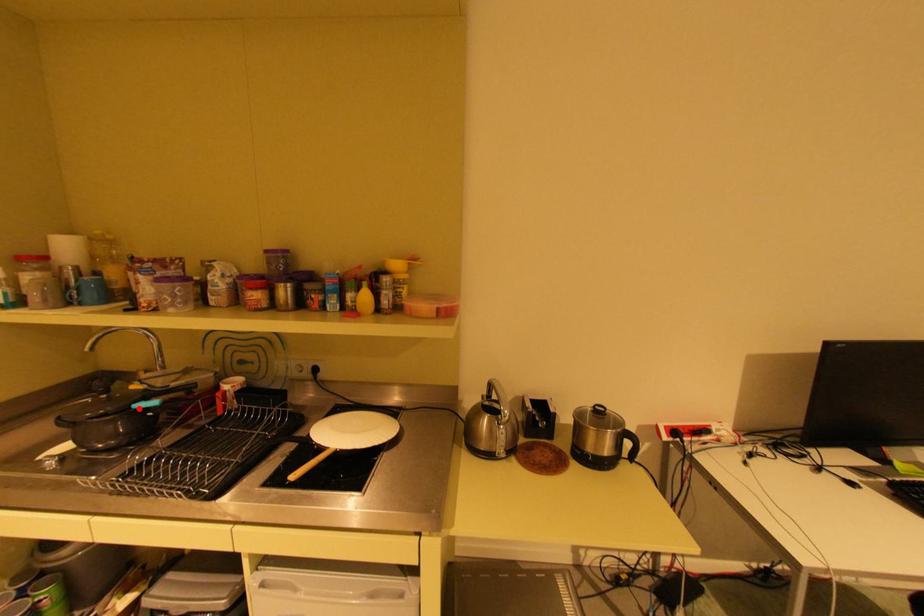
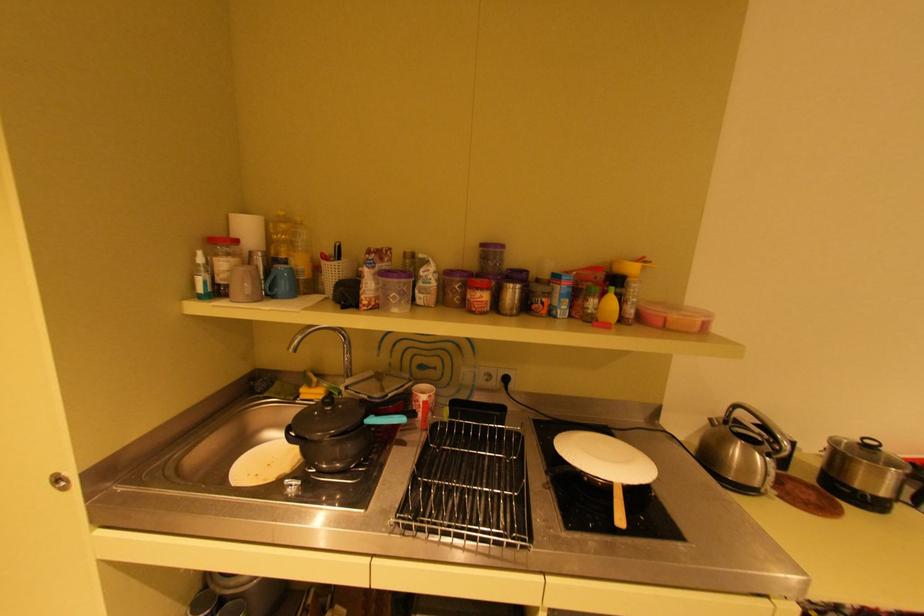
In the second image, find the point that corresponds to the highlighted location in the first image.

(371, 424)